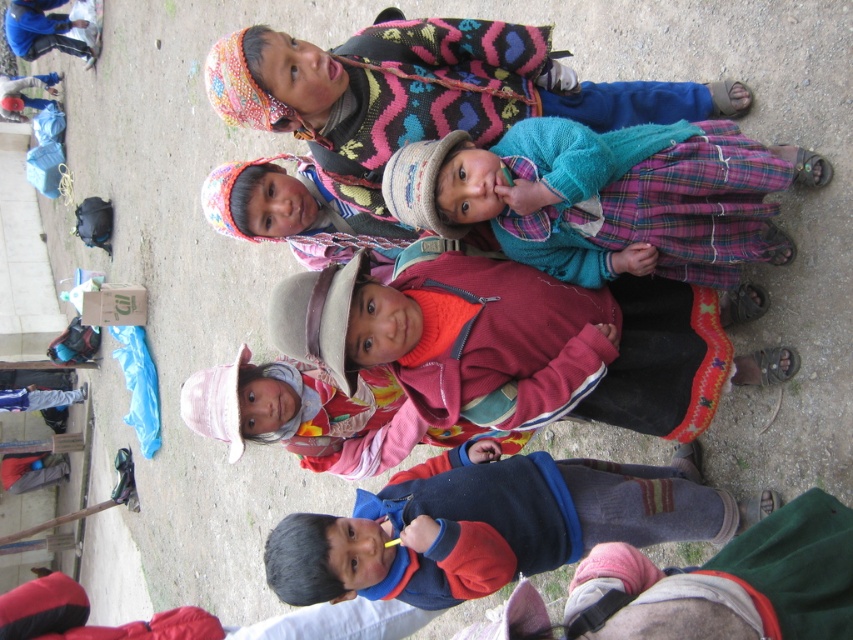
You are an observer looking at the children in the scene. Which of the two sweaters, the knitted wool sweater at center or the knitted multicolor sweater at upper center, appears narrower?

The knitted wool sweater at center has a lesser width compared to the knitted multicolor sweater at upper center, so the knitted wool sweater at center appears narrower.

You are a photographer trying to capture a detailed shot of the knitted teal sweater at center. Given that your camera focuses best at point coordinates between 0.2 and 0.8 on both axes, will the sweater be within the optimal focus range?

The knitted teal sweater at center is located at point coordinates 0.306 and 0.708, which falls within the optimal focus range of 0.2 to 0.8 on both axes. Therefore, the sweater will be within the optimal focus range.

Please provide the coordinates of the knitted wool sweater at center in the image. The coordinate system is normalized, with the origin at the bottom left corner of the image. Please respond with the coordinates in the format of a tuple with two decimal numbers, like this example format for a point at 50,50 pixels in a 100x100 image would be written as 0.5, 0.5.

The coordinates of the knitted wool sweater at center are at point (514,342).